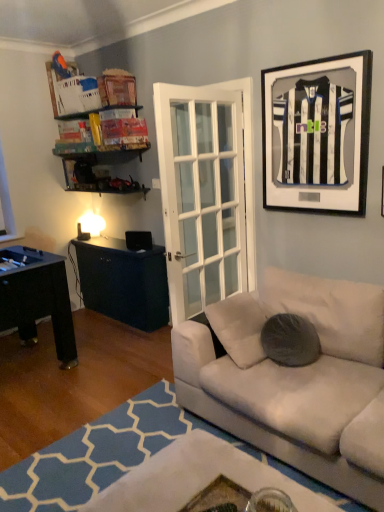
The image size is (384, 512). What are the coordinates of `black matte jersey at upper right` in the screenshot? It's located at (317, 134).

You are a GUI agent. You are given a task and a screenshot of the screen. Output one action in this format:
    pyautogui.click(x=<x>, y=<y>)
    Task: Click on the gray fuzzy pillow at center
    Image resolution: width=384 pixels, height=512 pixels.
    Given the screenshot: What is the action you would take?
    pyautogui.click(x=290, y=340)

Which object is closer to the camera, black matte jersey at upper right or white fabric couch at lower right?

white fabric couch at lower right is in front.

Which object is thinner, black matte jersey at upper right or white fabric couch at lower right?

Thinner between the two is black matte jersey at upper right.

Is black matte jersey at upper right directly adjacent to white fabric couch at lower right?

No, black matte jersey at upper right is not next to white fabric couch at lower right.

Considering the relative positions of black matte jersey at upper right and white fabric couch at lower right in the image provided, is black matte jersey at upper right to the right of white fabric couch at lower right from the viewer's perspective?

Yes.

Is black matte jersey at upper right positioned in front of gray fuzzy pillow at center?

Yes, it is in front of gray fuzzy pillow at center.

From a real-world perspective, is black matte jersey at upper right positioned over gray fuzzy pillow at center based on gravity?

Yes, from a real-world perspective, black matte jersey at upper right is above gray fuzzy pillow at center.

Is black matte jersey at upper right not near gray fuzzy pillow at center?

That's right, there is a large distance between black matte jersey at upper right and gray fuzzy pillow at center.

Considering the relative sizes of black matte jersey at upper right and gray fuzzy pillow at center in the image provided, is black matte jersey at upper right bigger than gray fuzzy pillow at center?

Yes, black matte jersey at upper right is bigger than gray fuzzy pillow at center.

Does gray fuzzy pillow at center have a lesser width compared to white fabric couch at lower right?

Correct, the width of gray fuzzy pillow at center is less than that of white fabric couch at lower right.

Consider the image. Is gray fuzzy pillow at center oriented towards white fabric couch at lower right?

No, gray fuzzy pillow at center is not aimed at white fabric couch at lower right.

Between gray fuzzy pillow at center and white fabric couch at lower right, which one appears on the left side from the viewer's perspective?

white fabric couch at lower right is more to the left.

How many degrees apart are the facing directions of gray fuzzy pillow at center and white fabric couch at lower right?

The facing directions of gray fuzzy pillow at center and white fabric couch at lower right are 116 degrees apart.

Which point is more distant from viewer, (303, 319) or (307, 202)?

The point (307, 202) is farther.

Considering the sizes of objects gray fuzzy pillow at center and black matte jersey at upper right in the image provided, who is taller, gray fuzzy pillow at center or black matte jersey at upper right?

Standing taller between the two is black matte jersey at upper right.

Between gray fuzzy pillow at center and black matte jersey at upper right, which one has smaller width?

black matte jersey at upper right is thinner.

Based on the photo, considering the relative positions of white fabric couch at lower right and black matte jersey at upper right in the image provided, is white fabric couch at lower right behind black matte jersey at upper right?

No, it is in front of black matte jersey at upper right.

Considering the points (255, 395) and (363, 166), which point is in front, point (255, 395) or point (363, 166)?

Point (255, 395)

From a real-world perspective, which object rests below the other?

From a 3D spatial view, white fabric couch at lower right is below.

Can we say white fabric couch at lower right lies outside gray fuzzy pillow at center?

Indeed, white fabric couch at lower right is completely outside gray fuzzy pillow at center.

Can you confirm if white fabric couch at lower right is wider than gray fuzzy pillow at center?

Yes.

Are white fabric couch at lower right and gray fuzzy pillow at center beside each other?

No, white fabric couch at lower right is not touching gray fuzzy pillow at center.

How many degrees apart are the facing directions of white fabric couch at lower right and gray fuzzy pillow at center?

The facing directions of white fabric couch at lower right and gray fuzzy pillow at center are 116 degrees apart.

This screenshot has width=384, height=512. In the image, there is a white fabric couch at lower right. In order to click on picture frame above it (from the image's perspective) in this screenshot , I will do `click(317, 134)`.

Locate an element on the screen. This screenshot has height=512, width=384. pillow below the black matte jersey at upper right (from the image's perspective) is located at coordinates (290, 340).

Looking at this image, considering their positions, is white fabric couch at lower right positioned closer to gray fuzzy pillow at center than black matte jersey at upper right?

white fabric couch at lower right.

When comparing their distances from white fabric couch at lower right, does gray fuzzy pillow at center or black matte jersey at upper right seem closer?

gray fuzzy pillow at center lies closer to white fabric couch at lower right than the other object.

Based on their spatial positions, is gray fuzzy pillow at center or white fabric couch at lower right closer to black matte jersey at upper right?

white fabric couch at lower right lies closer to black matte jersey at upper right than the other object.

Based on the photo, estimate the real-world distances between objects in this image. Which object is closer to black matte jersey at upper right, white fabric couch at lower right or gray fuzzy pillow at center?

white fabric couch at lower right lies closer to black matte jersey at upper right than the other object.

Considering their positions, is black matte jersey at upper right positioned further to gray fuzzy pillow at center than white fabric couch at lower right?

Among the two, black matte jersey at upper right is located further to gray fuzzy pillow at center.

Estimate the real-world distances between objects in this image. Which object is closer to white fabric couch at lower right, black matte jersey at upper right or gray fuzzy pillow at center?

gray fuzzy pillow at center is positioned closer to the anchor white fabric couch at lower right.

Where is `pillow between black matte jersey at upper right and white fabric couch at lower right vertically`? pillow between black matte jersey at upper right and white fabric couch at lower right vertically is located at coordinates (290, 340).